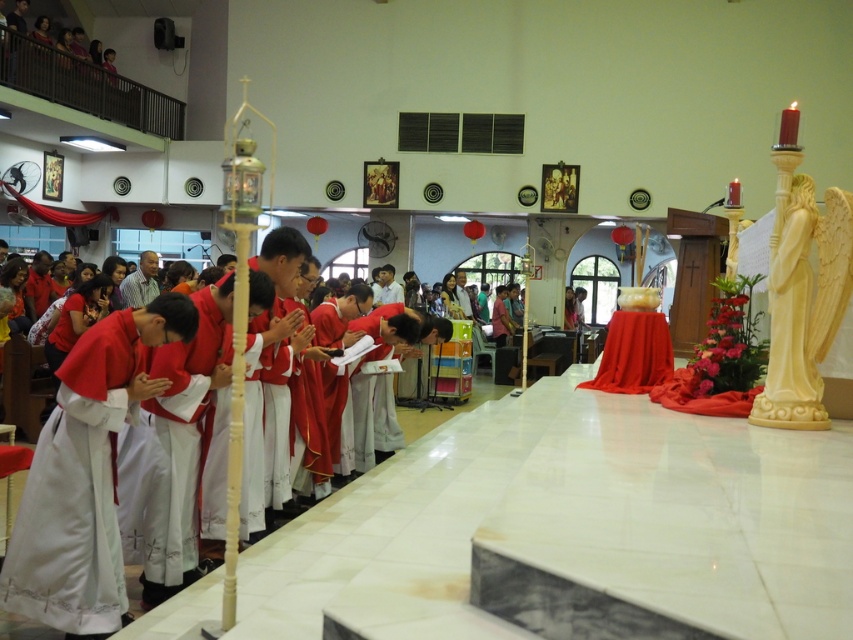
You are a photographer trying to capture the ceremony. You notice the white satin robe at lower left and the matte red robe at center. Which robe should you focus on to ensure it fills more of your camera frame?

The matte red robe at center is larger than the white satin robe at lower left, so focusing on it will fill more of the camera frame.